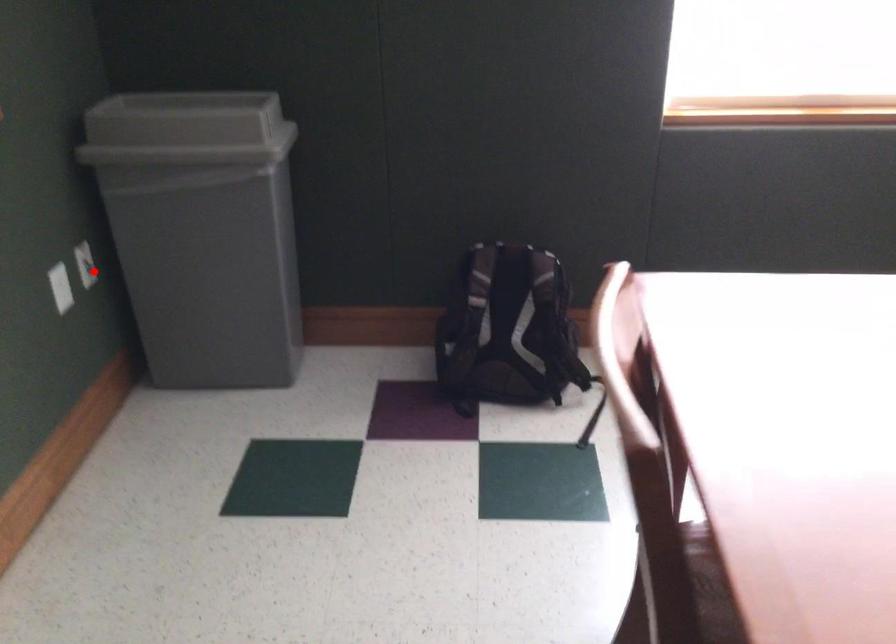
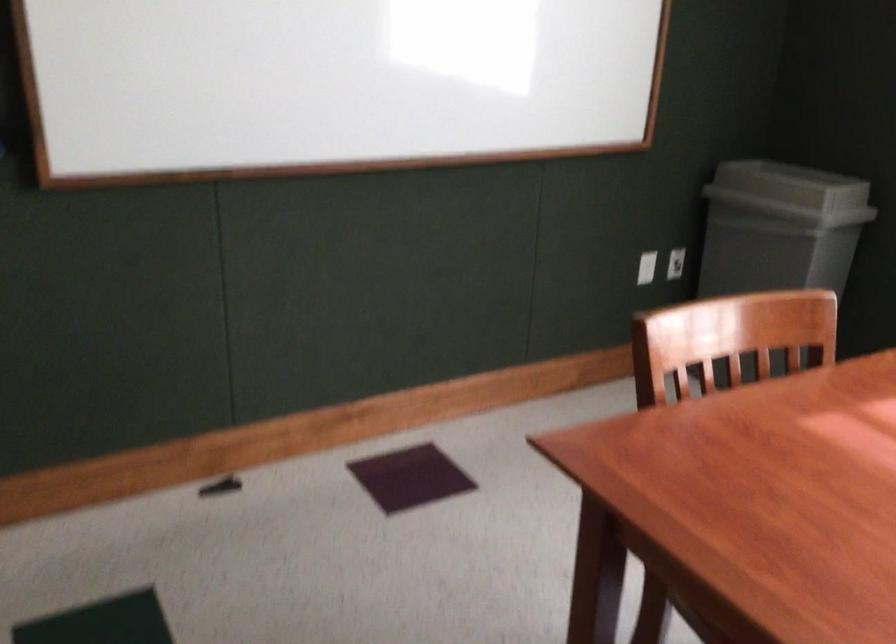
Locate, in the second image, the point that corresponds to the highlighted location in the first image.

(675, 263)